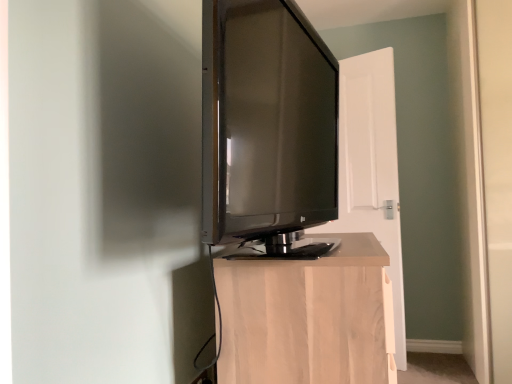
This screenshot has width=512, height=384. Find the location of `light wood cabinet at center`. light wood cabinet at center is located at coordinates (308, 316).

This screenshot has height=384, width=512. What do you see at coordinates (308, 316) in the screenshot? I see `light wood cabinet at center` at bounding box center [308, 316].

This screenshot has height=384, width=512. What do you see at coordinates (266, 122) in the screenshot?
I see `matte black tv at center` at bounding box center [266, 122].

Identify the location of white wood door at center. (372, 166).

Is white wood door at center not within light wood cabinet at center?

Yes, white wood door at center is not within light wood cabinet at center.

Measure the distance between white wood door at center and light wood cabinet at center.

They are 5.15 feet apart.

Based on the photo, is white wood door at center taller than light wood cabinet at center?

Yes, white wood door at center is taller than light wood cabinet at center.

In the scene shown: From a real-world perspective, which object rests below the other?

light wood cabinet at center.

Can you confirm if white wood door at center is shorter than matte black tv at center?

No, white wood door at center is not shorter than matte black tv at center.

Are white wood door at center and matte black tv at center making contact?

No, white wood door at center is not making contact with matte black tv at center.

At what (x,y) coordinates should I click in order to perform the action: click on television in front of the white wood door at center. Please return your answer as a coordinate pair (x, y). The width and height of the screenshot is (512, 384). Looking at the image, I should click on (266, 122).

Image resolution: width=512 pixels, height=384 pixels. Identify the location of furniture on the left of white wood door at center. (308, 316).

Which object is positioned more to the left, light wood cabinet at center or white wood door at center?

light wood cabinet at center is more to the left.

Relative to white wood door at center, is light wood cabinet at center in front or behind?

light wood cabinet at center is in front of white wood door at center.

Would you say light wood cabinet at center is a long distance from matte black tv at center?

No, light wood cabinet at center is in close proximity to matte black tv at center.

From the image's perspective, which is below, light wood cabinet at center or matte black tv at center?

light wood cabinet at center, from the image's perspective.

Looking at this image, in terms of size, does light wood cabinet at center appear bigger or smaller than matte black tv at center?

Clearly, light wood cabinet at center is larger in size than matte black tv at center.

Considering the points (332, 271) and (313, 114), which point is behind, point (332, 271) or point (313, 114)?

The point (313, 114) is farther.

Between matte black tv at center and light wood cabinet at center, which one has more height?

Standing taller between the two is matte black tv at center.

From the image's perspective, is matte black tv at center positioned above or below light wood cabinet at center?

matte black tv at center is situated higher than light wood cabinet at center in the image.

Which is behind, point (281, 201) or point (251, 365)?

The point (281, 201) is farther.

Is matte black tv at center wider or thinner than light wood cabinet at center?

Clearly, matte black tv at center has less width compared to light wood cabinet at center.

Who is smaller, matte black tv at center or white wood door at center?

white wood door at center is smaller.

Considering the positions of point (274, 203) and point (388, 240), is point (274, 203) closer or farther from the camera than point (388, 240)?

Point (274, 203).

In the scene shown: Relative to white wood door at center, is matte black tv at center in front or behind?

matte black tv at center is in front of white wood door at center.

What are the coordinates of `furniture in front of the white wood door at center` in the screenshot? It's located at (308, 316).

You are a GUI agent. You are given a task and a screenshot of the screen. Output one action in this format:
    pyautogui.click(x=<x>, y=<y>)
    Task: Click on the door located underneath the matte black tv at center (from a real-world perspective)
    The image size is (512, 384).
    Given the screenshot: What is the action you would take?
    pyautogui.click(x=372, y=166)

Based on their spatial positions, is light wood cabinet at center or matte black tv at center further from white wood door at center?

Among the two, light wood cabinet at center is located further to white wood door at center.

Based on the photo, looking at the image, which one is located closer to matte black tv at center, white wood door at center or light wood cabinet at center?

The object closer to matte black tv at center is light wood cabinet at center.

Based on their spatial positions, is white wood door at center or matte black tv at center closer to light wood cabinet at center?

Based on the image, matte black tv at center appears to be nearer to light wood cabinet at center.

From the image, which object appears to be nearer to matte black tv at center, light wood cabinet at center or white wood door at center?

light wood cabinet at center.

Based on their spatial positions, is matte black tv at center or light wood cabinet at center closer to white wood door at center?

Based on the image, matte black tv at center appears to be nearer to white wood door at center.

From the picture: Looking at the image, which one is located further to light wood cabinet at center, matte black tv at center or white wood door at center?

white wood door at center is further to light wood cabinet at center.

Locate an element on the screen. This screenshot has height=384, width=512. furniture between matte black tv at center and white wood door at center in the front-back direction is located at coordinates (308, 316).